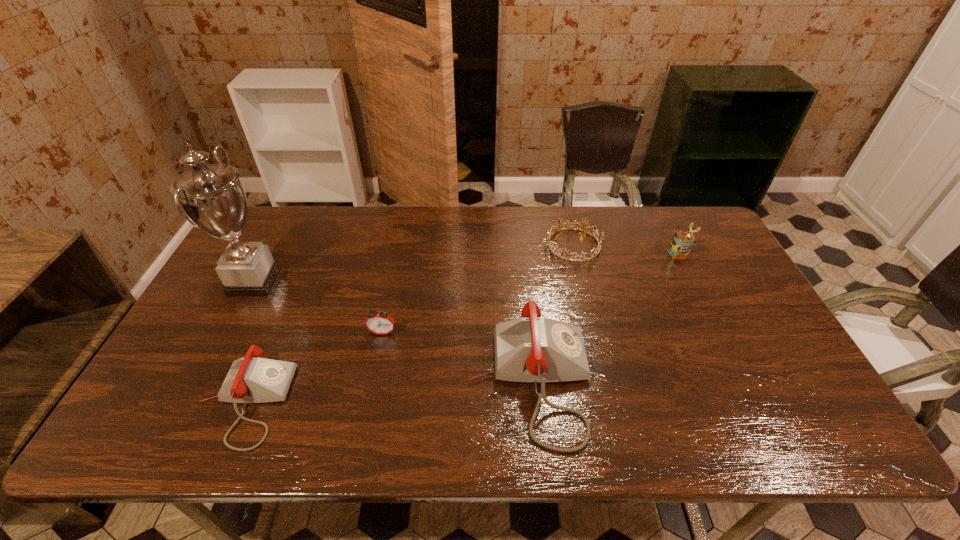
You are a GUI agent. You are given a task and a screenshot of the screen. Output one action in this format:
    pyautogui.click(x=<x>, y=<y>)
    Task: Click on the vacant point located between the right telephone and the can
    
    Given the screenshot: What is the action you would take?
    pyautogui.click(x=604, y=317)

What are the coordinates of `vacant area that lies between the alarm clock and the can` in the screenshot? It's located at (530, 293).

Identify the location of free spot between the can and the fourth object from right to left. This screenshot has width=960, height=540. (530, 293).

Where is `free space that is in between the fifth tallest object and the right telephone`? The width and height of the screenshot is (960, 540). free space that is in between the fifth tallest object and the right telephone is located at coordinates (386, 392).

The image size is (960, 540). Identify the location of free space between the rightmost object and the third object from left to right. (530, 293).

Locate an element on the screen. The image size is (960, 540). vacant area that lies between the shortest object and the shorter telephone is located at coordinates (409, 323).

You are a GUI agent. You are given a task and a screenshot of the screen. Output one action in this format:
    pyautogui.click(x=<x>, y=<y>)
    Task: Click on the vacant area that lies between the tiara and the trophy cup
    
    Given the screenshot: What is the action you would take?
    pyautogui.click(x=414, y=264)

Locate an element on the screen. This screenshot has height=540, width=960. vacant space in between the alarm clock and the rightmost object is located at coordinates (530, 293).

At what (x,y) coordinates should I click in order to perform the action: click on object that is the second closest one to the alarm clock. Please return your answer as a coordinate pair (x, y). This screenshot has height=540, width=960. Looking at the image, I should click on (530, 349).

Locate which object ranks fourth in proximity to the fourth object from right to left. Please provide its 2D coordinates. Your answer should be formatted as a tuple, i.e. [(x, y)], where the tuple contains the x and y coordinates of a point satisfying the conditions above.

[(548, 236)]